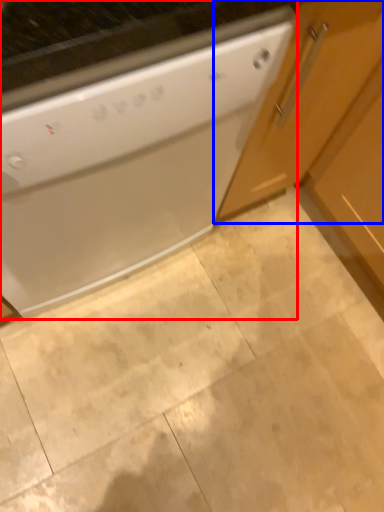
Question: Which object is closer to the camera taking this photo, home appliance (highlighted by a red box) or cabinetry (highlighted by a blue box)?

Choices:
 (A) home appliance
 (B) cabinetry

Answer: (A)